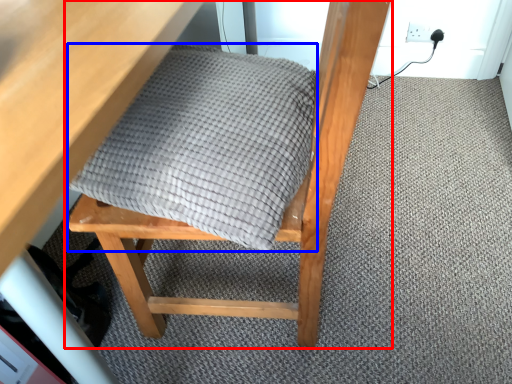
Question: Among these objects, which one is nearest to the camera, chair (highlighted by a red box) or blanket (highlighted by a blue box)?

Choices:
 (A) chair
 (B) blanket

Answer: (A)